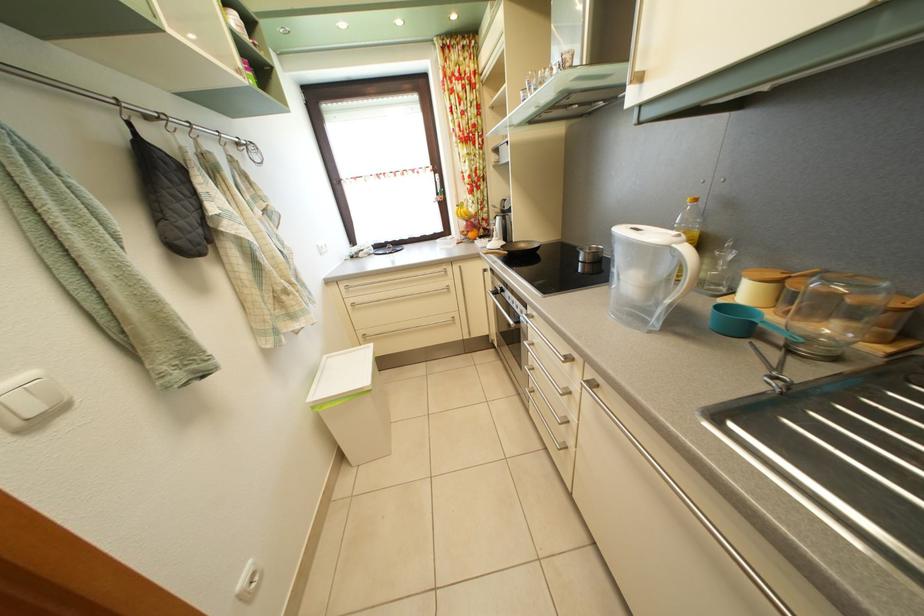
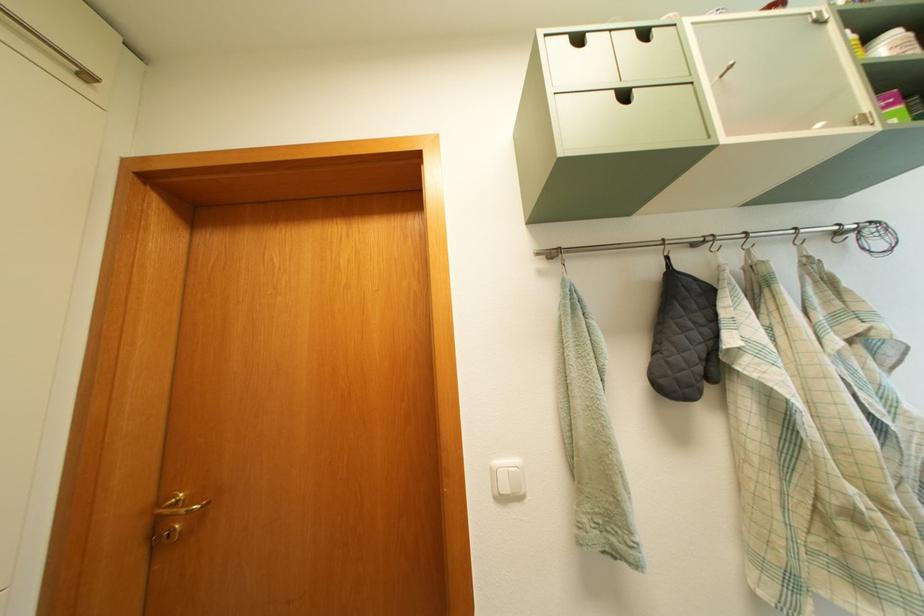
Question: The camera is either moving clockwise (left) or counter-clockwise (right) around the object. The first image is from the beginning of the video and the second image is from the end. Is the camera moving left or right when shooting the video?

Choices:
 (A) Left
 (B) Right

Answer: (B)